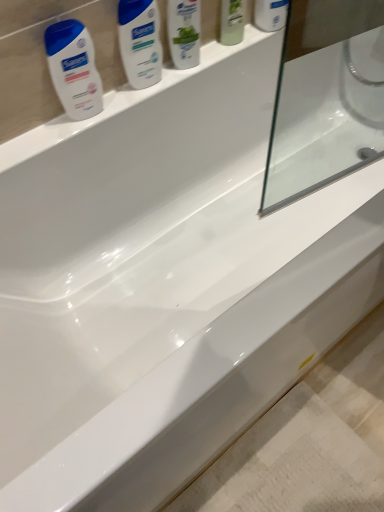
This screenshot has height=512, width=384. I want to click on vacant area that lies to the right of white glossy lotion at upper left, the first cleaning product from the bottom, so click(x=129, y=101).